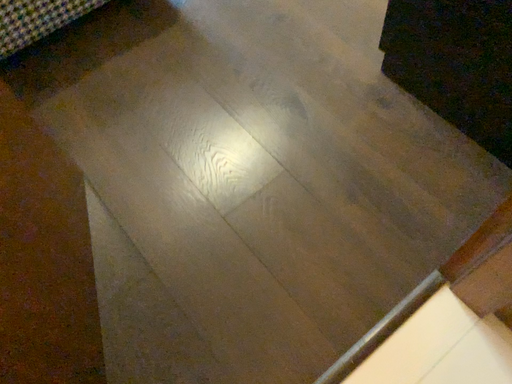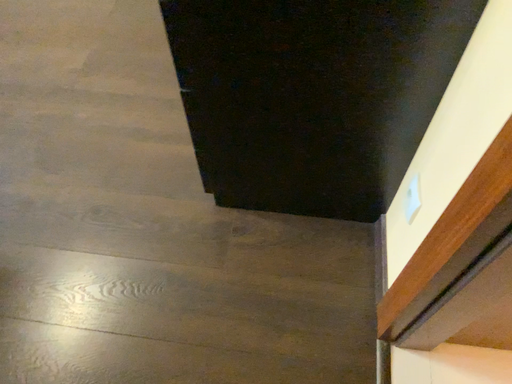
Question: How did the camera likely rotate when shooting the video?

Choices:
 (A) rotated upward
 (B) rotated downward

Answer: (A)